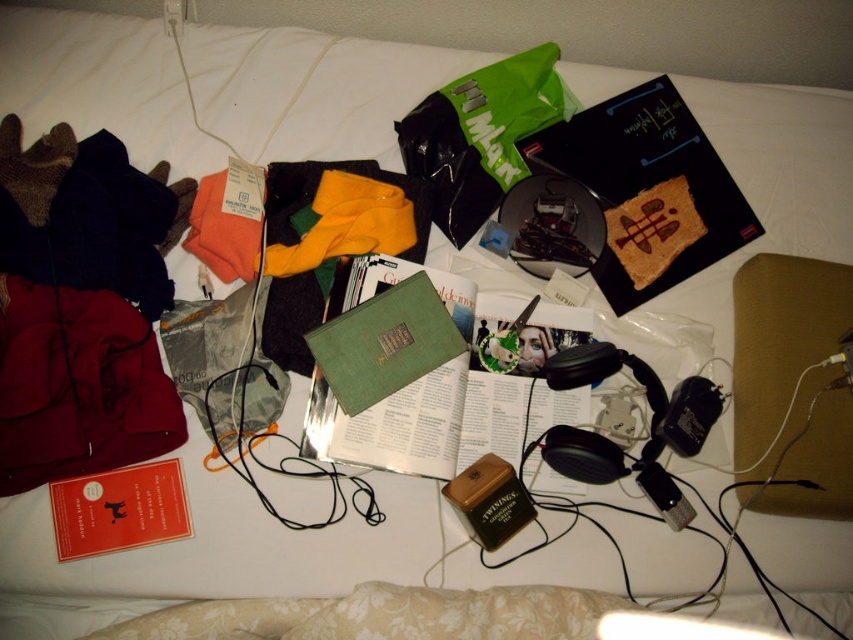
Does green matte book at center appear on the right side of dark red fabric at left?

Indeed, green matte book at center is positioned on the right side of dark red fabric at left.

I want to click on green matte book at center, so click(x=445, y=384).

The width and height of the screenshot is (853, 640). In order to click on green matte book at center in this screenshot , I will do point(445,384).

The image size is (853, 640). In order to click on green matte book at center in this screenshot , I will do `click(445, 384)`.

Does dark red fabric at left appear on the right side of hardcover book at center?

No, dark red fabric at left is not to the right of hardcover book at center.

Is dark red fabric at left taller than hardcover book at center?

In fact, dark red fabric at left may be shorter than hardcover book at center.

Is point (24, 481) positioned behind point (679, 176)?

No, (24, 481) is closer to viewer.

Where is `dark red fabric at left`? The image size is (853, 640). dark red fabric at left is located at coordinates (78, 385).

Does green matte book at center have a smaller size compared to hardcover book at center?

Indeed, green matte book at center has a smaller size compared to hardcover book at center.

How distant is green matte book at center from hardcover book at center?

green matte book at center and hardcover book at center are 9.39 inches apart from each other.

The image size is (853, 640). What do you see at coordinates (445, 384) in the screenshot? I see `green matte book at center` at bounding box center [445, 384].

The width and height of the screenshot is (853, 640). Find the location of `green matte book at center`. green matte book at center is located at coordinates (445, 384).